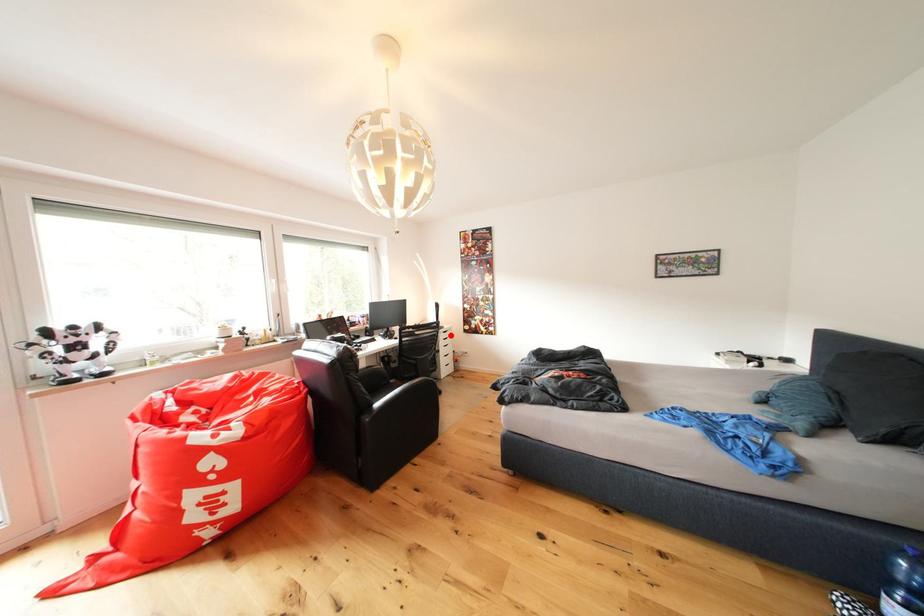
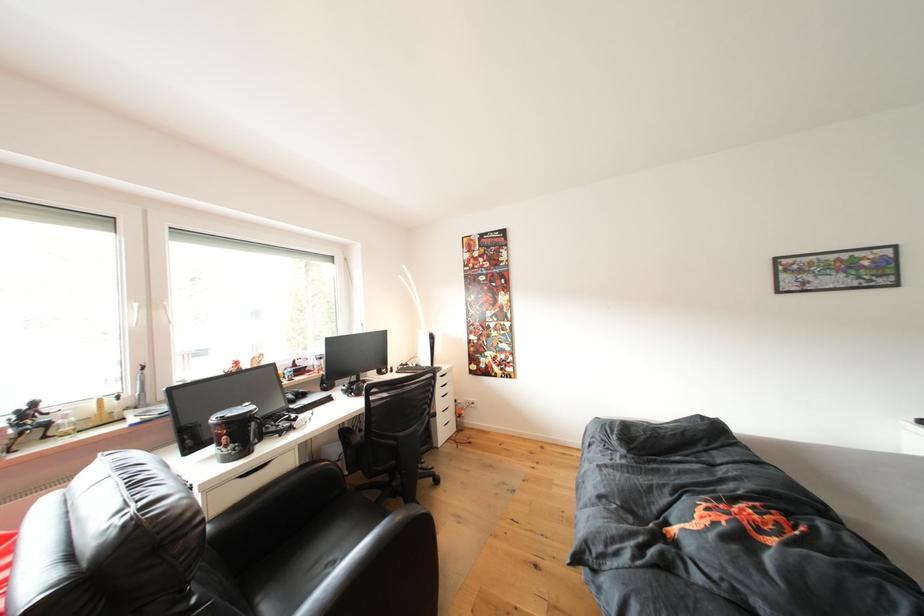
In the second image, find the point that corresponds to the highlighted location in the first image.

(447, 381)